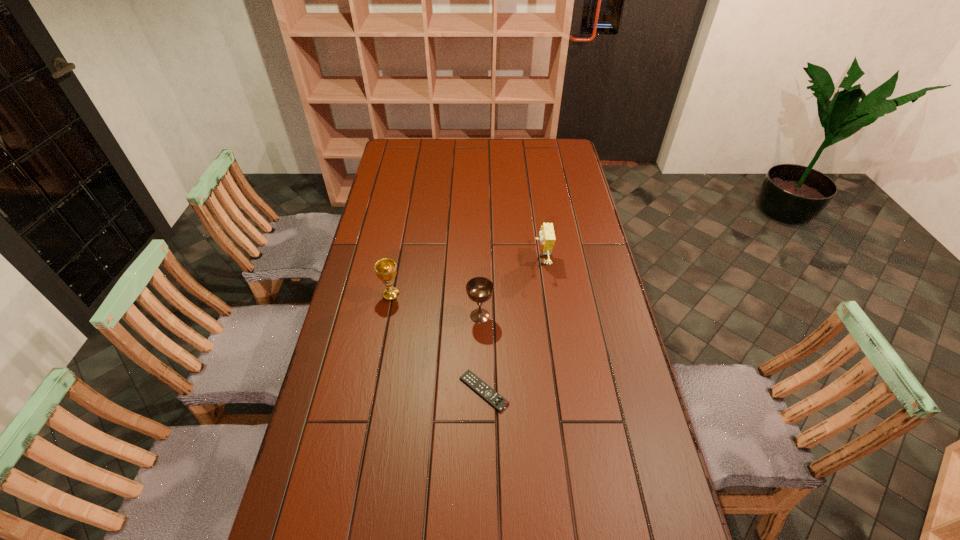
Point out which object is positioned as the second nearest to the nearer chalice. Please provide its 2D coordinates. Your answer should be formatted as a tuple, i.e. [(x, y)], where the tuple contains the x and y coordinates of a point satisfying the conditions above.

[(547, 238)]

Where is `free space that satisfies the following two spatial constraints: 1. on the face of the farthest object; 2. on the front side of the left chalice`? This screenshot has width=960, height=540. free space that satisfies the following two spatial constraints: 1. on the face of the farthest object; 2. on the front side of the left chalice is located at coordinates (546, 295).

The image size is (960, 540). I want to click on free spot that satisfies the following two spatial constraints: 1. on the face of the farthest object; 2. on the front side of the nearer chalice, so click(x=549, y=316).

The height and width of the screenshot is (540, 960). In order to click on free spot that satisfies the following two spatial constraints: 1. on the face of the sponge; 2. on the front side of the third farthest object in this screenshot , I will do `click(549, 316)`.

The width and height of the screenshot is (960, 540). What are the coordinates of `free space that satisfies the following two spatial constraints: 1. on the face of the sponge; 2. on the front side of the nearer chalice` in the screenshot? It's located at (549, 316).